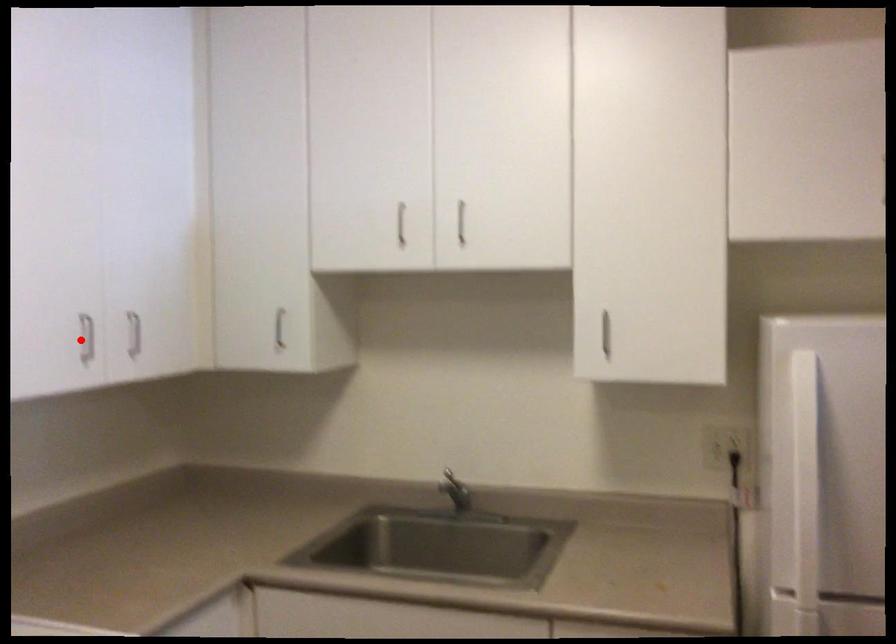
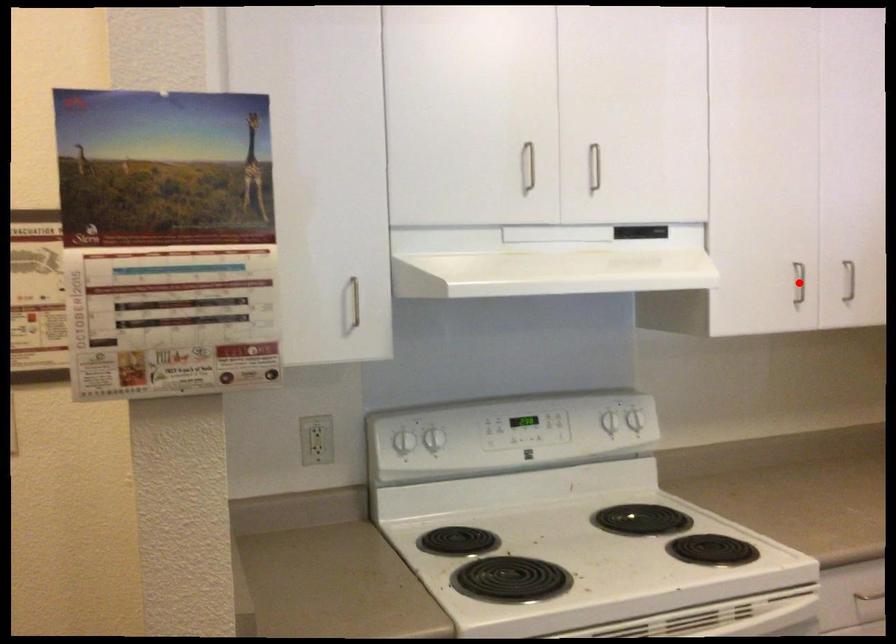
I am providing you with two images of the same scene from different viewpoints. A red point is marked on the first image and another point is marked on the second image. Is the red point in image1 aligned with the point shown in image2?

Yes